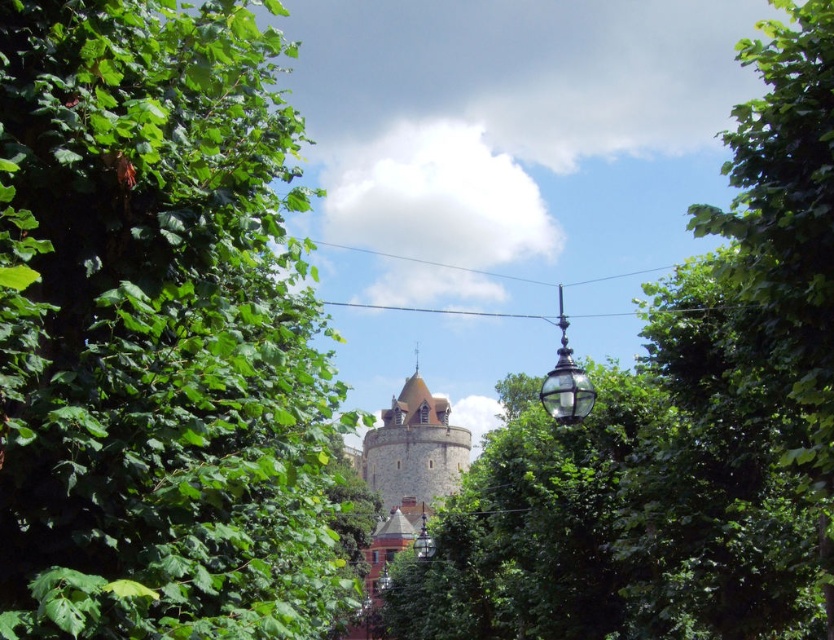
You are standing in the corridor formed by the green foliage and want to walk towards the stone tower at center. Which direction should you walk relative to the green leafy tree at center?

You should walk to the left of the green leafy tree at center because the stone tower at center is positioned to the left of it.

You are standing at the point marked as point [677,424] in the image. Looking around, you see a green leafy tree at center. What is directly in front of you?

The green leafy tree at center is directly in front of you at point [677,424].

You are standing in a corridor flanked by green foliage leading to a historic stone tower. You notice a green leafy tree at center. Can you determine its exact location in the scene using coordinates?

The green leafy tree at center is located at coordinates point (677, 424).